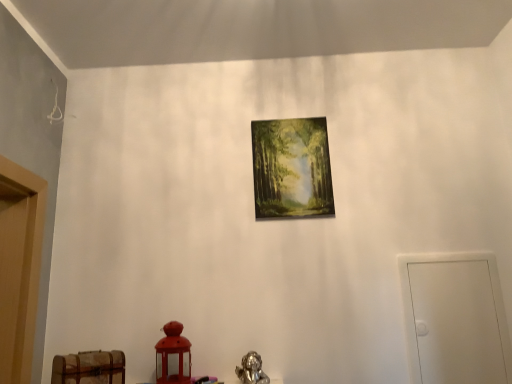
Question: Should I look upward or downward to see matte wooden picture frame at center?

Choices:
 (A) up
 (B) down

Answer: (A)

Question: Is wooden chest at lower left to the right of white matte door at right from the viewer's perspective?

Choices:
 (A) yes
 (B) no

Answer: (B)

Question: Does wooden chest at lower left have a greater width compared to white matte door at right?

Choices:
 (A) yes
 (B) no

Answer: (A)

Question: Considering the relative sizes of wooden chest at lower left and white matte door at right in the image provided, is wooden chest at lower left taller than white matte door at right?

Choices:
 (A) no
 (B) yes

Answer: (A)

Question: Is wooden chest at lower left positioned before white matte door at right?

Choices:
 (A) yes
 (B) no

Answer: (A)

Question: From a real-world perspective, is wooden chest at lower left beneath white matte door at right?

Choices:
 (A) yes
 (B) no

Answer: (A)

Question: From a real-world perspective, is wooden chest at lower left located higher than white matte door at right?

Choices:
 (A) no
 (B) yes

Answer: (A)

Question: Does matte wooden picture frame at center lie behind white matte door at right?

Choices:
 (A) yes
 (B) no

Answer: (A)

Question: Considering the relative sizes of matte wooden picture frame at center and white matte door at right in the image provided, is matte wooden picture frame at center wider than white matte door at right?

Choices:
 (A) yes
 (B) no

Answer: (B)

Question: Considering the relative sizes of matte wooden picture frame at center and white matte door at right in the image provided, is matte wooden picture frame at center taller than white matte door at right?

Choices:
 (A) yes
 (B) no

Answer: (B)

Question: Can we say matte wooden picture frame at center lies outside white matte door at right?

Choices:
 (A) no
 (B) yes

Answer: (B)

Question: Are matte wooden picture frame at center and white matte door at right located far from each other?

Choices:
 (A) yes
 (B) no

Answer: (B)

Question: Can you confirm if matte wooden picture frame at center is positioned to the left of white matte door at right?

Choices:
 (A) yes
 (B) no

Answer: (A)

Question: From the image's perspective, is wooden chest at lower left below matte wooden picture frame at center?

Choices:
 (A) no
 (B) yes

Answer: (B)